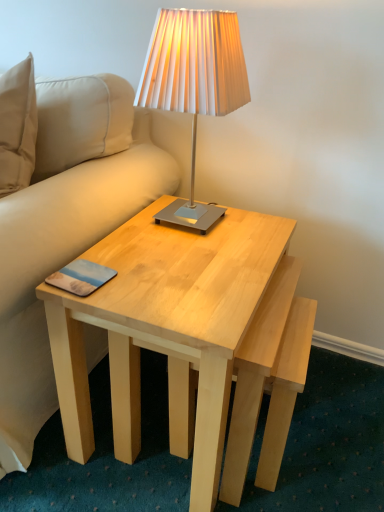
Find the location of `free space in front of matte silver lamp at upper center`. free space in front of matte silver lamp at upper center is located at coordinates (190, 259).